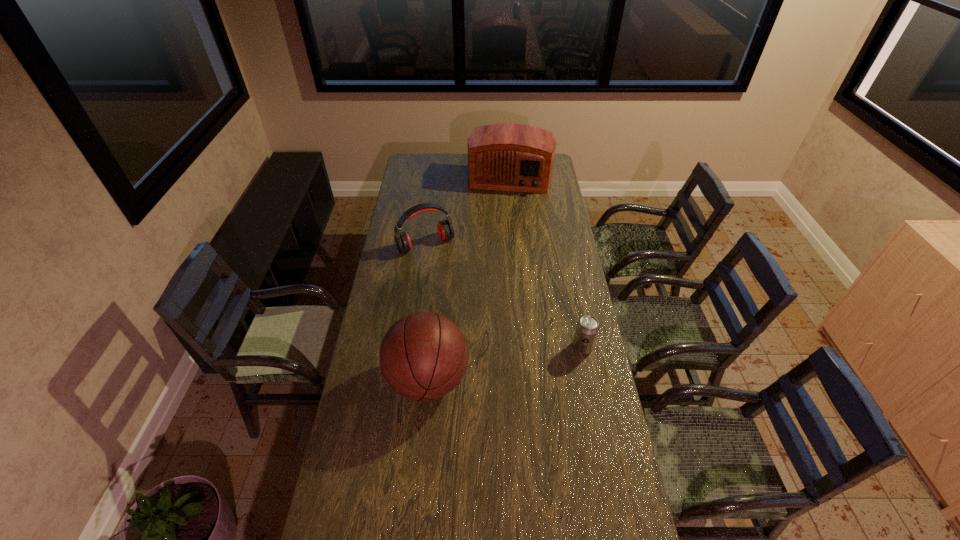
In order to click on vacant space located on the ear cups of the third nearest object in this screenshot , I will do `click(472, 315)`.

This screenshot has height=540, width=960. I want to click on vacant area situated 0.290m on the ear cups of the third nearest object, so click(x=462, y=298).

Where is `free space located on the ear cups of the third nearest object`? free space located on the ear cups of the third nearest object is located at coordinates tap(444, 267).

I want to click on object that is at the far edge, so click(515, 157).

At what (x,y) coordinates should I click in order to perform the action: click on basketball that is at the left edge. Please return your answer as a coordinate pair (x, y). The height and width of the screenshot is (540, 960). Looking at the image, I should click on (423, 356).

At what (x,y) coordinates should I click in order to perform the action: click on earphone at the left edge. Please return your answer as a coordinate pair (x, y). Looking at the image, I should click on (445, 229).

Where is `beer can that is at the right edge`? The width and height of the screenshot is (960, 540). beer can that is at the right edge is located at coordinates (587, 328).

This screenshot has width=960, height=540. Identify the location of radio receiver that is positioned at the right edge. [515, 157].

This screenshot has width=960, height=540. Find the location of `object that is at the far right corner`. object that is at the far right corner is located at coordinates (515, 157).

Find the location of a particular element. free region at the far edge of the desktop is located at coordinates click(449, 154).